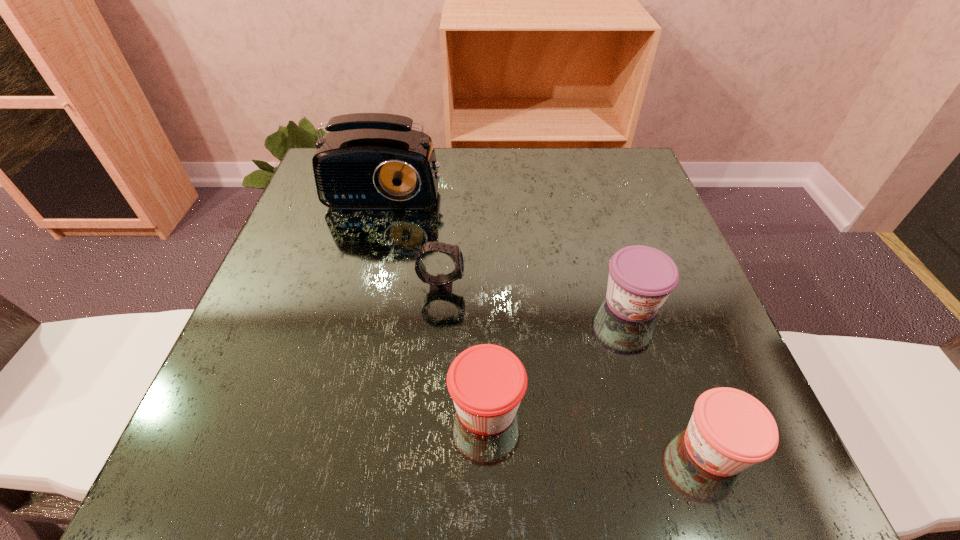
Image resolution: width=960 pixels, height=540 pixels. In order to click on free space that is in between the watch and the farthest object in this screenshot , I will do `click(416, 232)`.

The image size is (960, 540). I want to click on free space between the leftmost jam and the farthest jam, so click(x=559, y=355).

Find the location of a particular element. blank region between the leftmost jam and the farthest jam is located at coordinates (559, 355).

This screenshot has width=960, height=540. Identify the location of free area in between the leftmost jam and the farthest jam. (559, 355).

I want to click on vacant area that lies between the watch and the farthest object, so tap(416, 232).

This screenshot has height=540, width=960. I want to click on vacant region between the leftmost jam and the watch, so click(x=464, y=347).

Identify the location of vacant area that lies between the farthest jam and the leftmost jam. (559, 355).

Identify which object is the second closest to the leftmost jam. Please provide its 2D coordinates. Your answer should be formatted as a tuple, i.e. [(x, y)], where the tuple contains the x and y coordinates of a point satisfying the conditions above.

[(641, 278)]

Identify which object is located as the third nearest to the watch. Please provide its 2D coordinates. Your answer should be formatted as a tuple, i.e. [(x, y)], where the tuple contains the x and y coordinates of a point satisfying the conditions above.

[(641, 278)]

You are a GUI agent. You are given a task and a screenshot of the screen. Output one action in this format:
    pyautogui.click(x=<x>, y=<y>)
    Task: Click on the jam that stands as the second closest to the radio receiver
    The width and height of the screenshot is (960, 540).
    Given the screenshot: What is the action you would take?
    pyautogui.click(x=487, y=382)